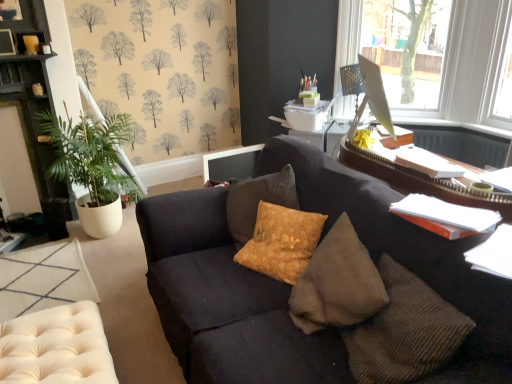
Question: Considering the positions of transparent glass monitor at upper right and matte cream tufted swivel chair at lower left in the image, is transparent glass monitor at upper right wider or thinner than matte cream tufted swivel chair at lower left?

Choices:
 (A) thin
 (B) wide

Answer: (A)

Question: Considering the positions of transparent glass monitor at upper right and matte cream tufted swivel chair at lower left in the image, is transparent glass monitor at upper right bigger or smaller than matte cream tufted swivel chair at lower left?

Choices:
 (A) big
 (B) small

Answer: (A)

Question: Estimate the real-world distances between objects in this image. Which object is closer to the beige tufted ottoman at lower left?

Choices:
 (A) green leafy plant at left
 (B) dark gray fabric couch at center
 (C) suede textured pillow at center
 (D) transparent glass monitor at upper right
 (E) dark wood cabinet at left

Answer: (A)

Question: Estimate the real-world distances between objects in this image. Which object is farther from the dark wood cabinet at left?

Choices:
 (A) matte cream tufted swivel chair at lower left
 (B) transparent glass monitor at upper right
 (C) beige tufted ottoman at lower left
 (D) suede textured pillow at center
 (E) dark gray fabric couch at center

Answer: (B)